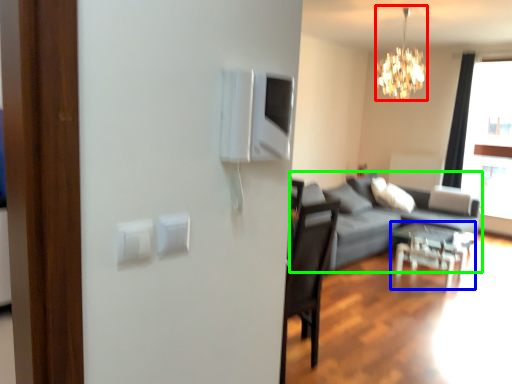
Question: Which object is the closest to the lamp (highlighted by a red box)? Choose among these: table (highlighted by a blue box) or studio couch (highlighted by a green box).

Choices:
 (A) table
 (B) studio couch

Answer: (B)